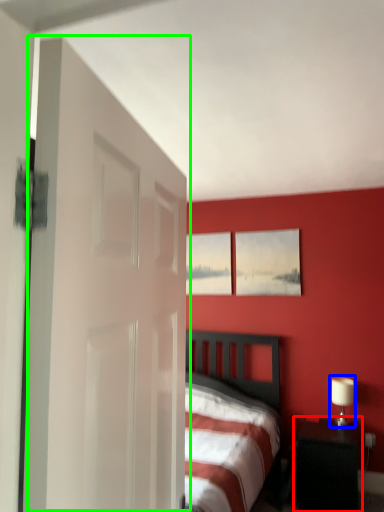
Question: Considering the real-world distances, which object is farthest from nightstand (highlighted by a red box)? table lamp (highlighted by a blue box) or door (highlighted by a green box)?

Choices:
 (A) table lamp
 (B) door

Answer: (B)